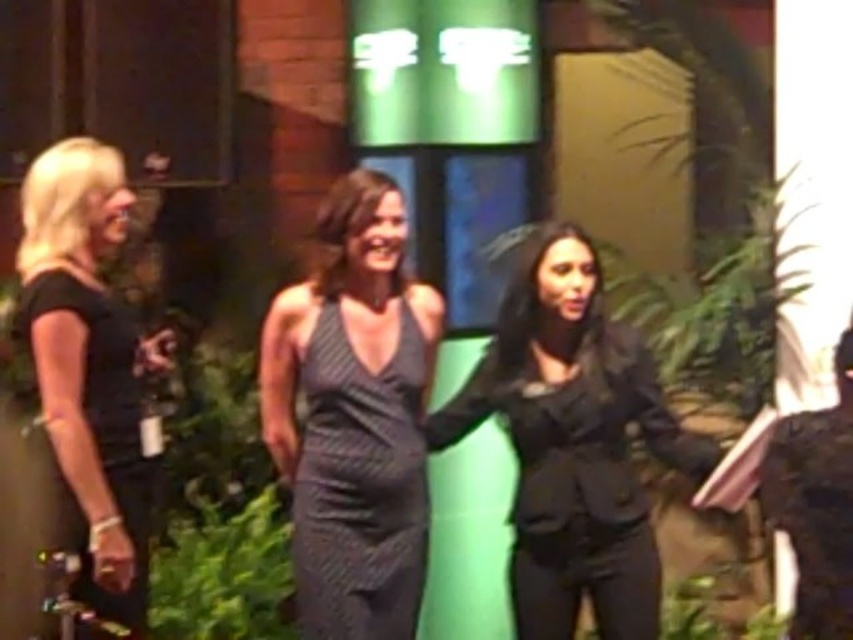
From the picture: You are trying to take a photo of the dark brown leather jacket at right without including the black matte blazer at center in the frame. Is this possible given their positions?

The dark brown leather jacket at right is behind the black matte blazer at center, so it is not possible to take a photo of the dark brown leather jacket at right without including the black matte blazer at center in the frame.

You are standing at the point with coordinates (572, 442) in the image. What object are you standing on?

The point at coordinates (572, 442) is on the black matte blazer at center.

Consider the image. You are at a formal event and see two women in black attire. The first is wearing a black textured dress at center, and the second is wearing a black matte blazer at center. Which one is standing to the right of the other?

The black matte blazer at center is positioned on the right side of the black textured dress at center.